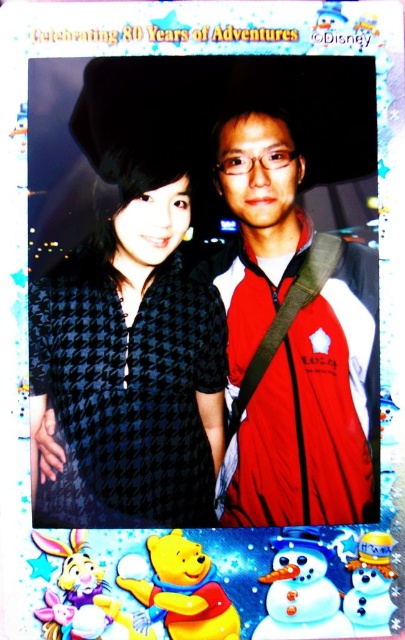
You are planning to mail this Polaroid photo, but you need to ensure the red matte jacket at right and the white matte snowman at center won

The red matte jacket at right is larger than the white matte snowman at center, so it may not fit in a standard mailer envelope designed for smaller items. Consider using a larger envelope or a box to accommodate the size of the red matte jacket at right.